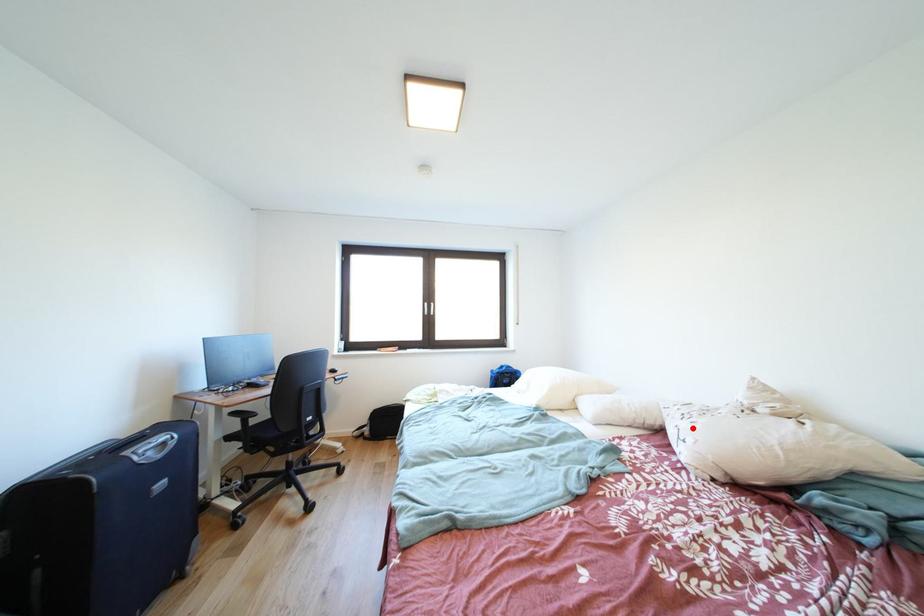
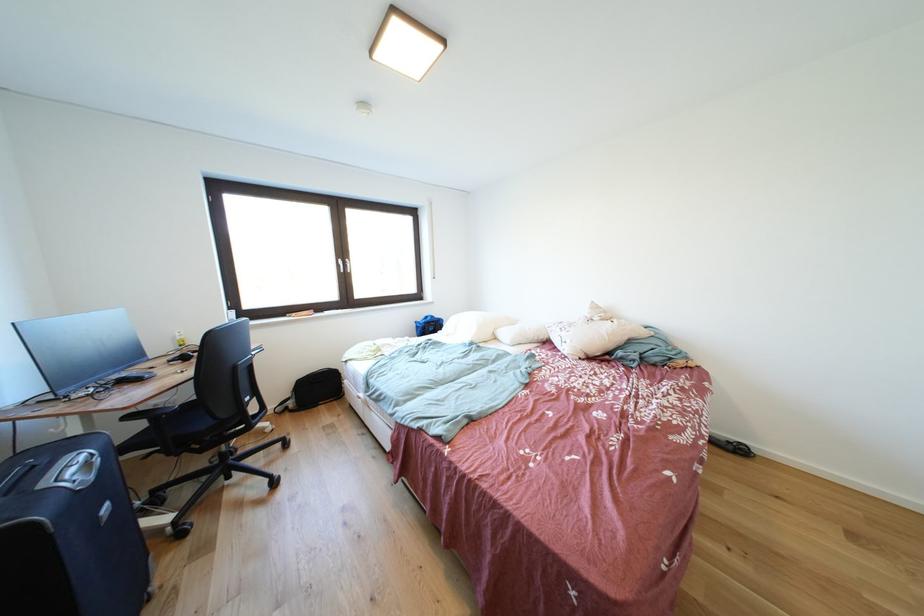
Find the pixel in the second image that matches the highlighted location in the first image.

(572, 338)